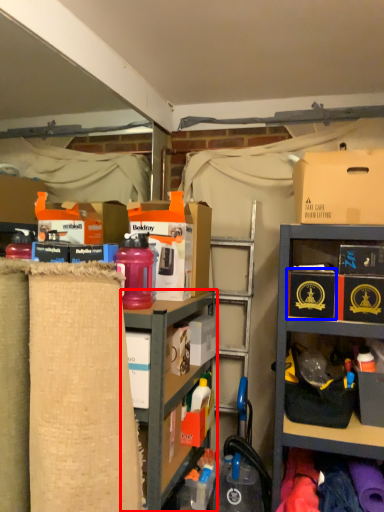
Question: Which of the following is the closest to the observer, shelf (highlighted by a red box) or storage box (highlighted by a blue box)?

Choices:
 (A) shelf
 (B) storage box

Answer: (A)